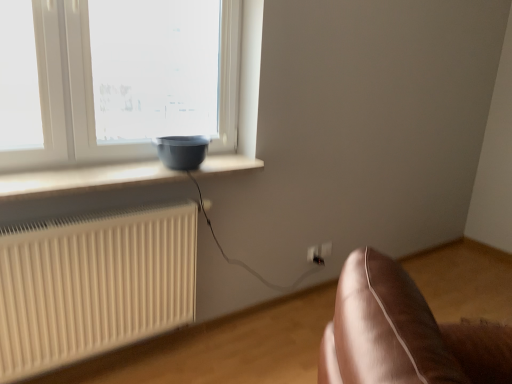
This screenshot has width=512, height=384. What do you see at coordinates (314, 255) in the screenshot? I see `white plastic electric outlet at lower right, which is the 1th electric outlet in left-to-right order` at bounding box center [314, 255].

Locate an element on the screen. white plastic electric outlet at lower right, the first electric outlet viewed from the right is located at coordinates (325, 250).

Considering the relative sizes of white plastic electric outlet at lower right, the second electric outlet when ordered from left to right, and matte black bowl at left in the image provided, is white plastic electric outlet at lower right, the second electric outlet when ordered from left to right, shorter than matte black bowl at left?

Incorrect, the height of white plastic electric outlet at lower right, the second electric outlet when ordered from left to right, does not fall short of that of matte black bowl at left.

How much distance is there between white plastic electric outlet at lower right, acting as the 2th electric outlet starting from the front, and matte black bowl at left?

They are 4.29 feet apart.

From a real-world perspective, between white plastic electric outlet at lower right, acting as the 2th electric outlet starting from the front, and matte black bowl at left, who is vertically higher?

matte black bowl at left is physically above.

How many degrees apart are the facing directions of white plastic electric outlet at lower right, the second electric outlet when ordered from left to right, and matte black bowl at left?

0.199 degrees separate the facing orientations of white plastic electric outlet at lower right, the second electric outlet when ordered from left to right, and matte black bowl at left.

Considering the sizes of objects white plastic electric outlet at lower right, the first electric outlet when ordered from back to front, and matte gray bowl at window in the image provided, who is taller, white plastic electric outlet at lower right, the first electric outlet when ordered from back to front, or matte gray bowl at window?

matte gray bowl at window.

Is white plastic electric outlet at lower right, the second electric outlet when ordered from left to right, further to the viewer compared to matte gray bowl at window?

Yes, it is behind matte gray bowl at window.

Considering the relative positions of white plastic electric outlet at lower right, acting as the 2th electric outlet starting from the front, and matte gray bowl at window in the image provided, is white plastic electric outlet at lower right, acting as the 2th electric outlet starting from the front, to the left or to the right of matte gray bowl at window?

white plastic electric outlet at lower right, acting as the 2th electric outlet starting from the front, is to the right of matte gray bowl at window.

Does white plastic electric outlet at lower right, acting as the 2th electric outlet starting from the front, turn towards matte gray bowl at window?

No.

Between white plastic electric outlet at lower right, marked as the second electric outlet in a right-to-left arrangement, and matte gray bowl at window, which one has larger size?

With larger size is matte gray bowl at window.

From the image's perspective, is white plastic electric outlet at lower right, the 1th electric outlet positioned from the front, beneath matte gray bowl at window?

Yes.

Is the position of white plastic electric outlet at lower right, which is the 1th electric outlet in left-to-right order, less distant than that of matte gray bowl at window?

No, it is behind matte gray bowl at window.

Which is farther from the camera, [315,253] or [199,165]?

Positioned behind is point [315,253].

Identify the location of window sill to the left of white plastic electric outlet at lower right, marked as the second electric outlet in a back-to-front arrangement. This screenshot has width=512, height=384. (84, 179).

Is matte black bowl at left directly adjacent to white plastic electric outlet at lower right, marked as the second electric outlet in a right-to-left arrangement?

matte black bowl at left and white plastic electric outlet at lower right, marked as the second electric outlet in a right-to-left arrangement, are clearly separated.

Is white plastic electric outlet at lower right, the 1th electric outlet positioned from the front, at the back of matte black bowl at left?

No, white plastic electric outlet at lower right, the 1th electric outlet positioned from the front, is not at the back of matte black bowl at left.

Can you tell me how much white plastic electric outlet at lower right, the first electric outlet viewed from the right, and white plastic electric outlet at lower right, marked as the second electric outlet in a right-to-left arrangement, differ in facing direction?

The angle between the facing direction of white plastic electric outlet at lower right, the first electric outlet viewed from the right, and the facing direction of white plastic electric outlet at lower right, marked as the second electric outlet in a right-to-left arrangement, is 4.12 degrees.

Which is behind, point (320, 254) or point (314, 258)?

The point (320, 254) is more distant.

Is white plastic electric outlet at lower right, acting as the 2th electric outlet starting from the front, not inside white plastic electric outlet at lower right, the 1th electric outlet positioned from the front?

Yes, white plastic electric outlet at lower right, acting as the 2th electric outlet starting from the front, is located beyond the bounds of white plastic electric outlet at lower right, the 1th electric outlet positioned from the front.

Does point (195, 165) appear closer or farther from the camera than point (317, 263)?

Point (195, 165) appears to be closer to the viewer than point (317, 263).

Is matte gray bowl at window further to camera compared to white plastic electric outlet at lower right, the 1th electric outlet positioned from the front?

No, it is in front of white plastic electric outlet at lower right, the 1th electric outlet positioned from the front.

Considering the sizes of objects matte gray bowl at window and white plastic electric outlet at lower right, which is the 1th electric outlet in left-to-right order, in the image provided, who is taller, matte gray bowl at window or white plastic electric outlet at lower right, which is the 1th electric outlet in left-to-right order,?

Standing taller between the two is matte gray bowl at window.

Between matte gray bowl at window and white plastic electric outlet at lower right, the 1th electric outlet positioned from the front, which one has smaller size?

white plastic electric outlet at lower right, the 1th electric outlet positioned from the front.

Based on the photo, does white plastic electric outlet at lower right, the 1th electric outlet positioned from the front, have a smaller size compared to white ribbed radiator at lower left?

Yes.

Locate an element on the screen. Image resolution: width=512 pixels, height=384 pixels. radiator on the left of the white plastic electric outlet at lower right, marked as the second electric outlet in a back-to-front arrangement is located at coordinates (93, 285).

Is white plastic electric outlet at lower right, marked as the second electric outlet in a back-to-front arrangement, to the left of white ribbed radiator at lower left from the viewer's perspective?

No, white plastic electric outlet at lower right, marked as the second electric outlet in a back-to-front arrangement, is not to the left of white ribbed radiator at lower left.

Is white plastic electric outlet at lower right, which is the 1th electric outlet in left-to-right order, further to camera compared to white ribbed radiator at lower left?

Yes, the depth of white plastic electric outlet at lower right, which is the 1th electric outlet in left-to-right order, is greater than that of white ribbed radiator at lower left.

Image resolution: width=512 pixels, height=384 pixels. I want to click on the 2nd electric outlet counting from the right side of the matte black bowl at left, so click(325, 250).

At what (x,y) coordinates should I click in order to perform the action: click on bowl that appears in front of the white plastic electric outlet at lower right, the second electric outlet when ordered from left to right. Please return your answer as a coordinate pair (x, y). Looking at the image, I should click on (182, 151).

When comparing their distances from white plastic electric outlet at lower right, the first electric outlet viewed from the right, does matte black bowl at left or matte gray bowl at window seem further?

matte black bowl at left.

Consider the image. Based on their spatial positions, is matte gray bowl at window or matte black bowl at left further from white ribbed radiator at lower left?

The object further to white ribbed radiator at lower left is matte gray bowl at window.

When comparing their distances from white plastic electric outlet at lower right, the first electric outlet when ordered from back to front, does white plastic electric outlet at lower right, marked as the second electric outlet in a right-to-left arrangement, or matte black bowl at left seem closer?

white plastic electric outlet at lower right, marked as the second electric outlet in a right-to-left arrangement, is closer to white plastic electric outlet at lower right, the first electric outlet when ordered from back to front.

Based on their spatial positions, is white plastic electric outlet at lower right, the first electric outlet viewed from the right, or matte black bowl at left further from white plastic electric outlet at lower right, which is the 1th electric outlet in left-to-right order?

matte black bowl at left.

Looking at the image, which one is located closer to white plastic electric outlet at lower right, marked as the second electric outlet in a back-to-front arrangement, matte gray bowl at window or matte black bowl at left?

matte gray bowl at window lies closer to white plastic electric outlet at lower right, marked as the second electric outlet in a back-to-front arrangement, than the other object.

Estimate the real-world distances between objects in this image. Which object is further from white plastic electric outlet at lower right, the first electric outlet when ordered from back to front, matte black bowl at left or white plastic electric outlet at lower right, marked as the second electric outlet in a back-to-front arrangement?

Among the two, matte black bowl at left is located further to white plastic electric outlet at lower right, the first electric outlet when ordered from back to front.

Looking at the image, which one is located further to white ribbed radiator at lower left, white plastic electric outlet at lower right, which is the 1th electric outlet in left-to-right order, or matte gray bowl at window?

Among the two, white plastic electric outlet at lower right, which is the 1th electric outlet in left-to-right order, is located further to white ribbed radiator at lower left.

When comparing their distances from matte black bowl at left, does white plastic electric outlet at lower right, the first electric outlet viewed from the right, or white ribbed radiator at lower left seem closer?

white ribbed radiator at lower left lies closer to matte black bowl at left than the other object.

This screenshot has height=384, width=512. What are the coordinates of `bowl between white ribbed radiator at lower left and white plastic electric outlet at lower right, the 1th electric outlet positioned from the front, in the front-back direction` in the screenshot? It's located at (182, 151).

Locate an element on the screen. The height and width of the screenshot is (384, 512). window sill between matte gray bowl at window and white ribbed radiator at lower left in the vertical direction is located at coordinates pyautogui.click(x=84, y=179).

This screenshot has height=384, width=512. I want to click on electric outlet between matte black bowl at left and white plastic electric outlet at lower right, acting as the 2th electric outlet starting from the front, along the z-axis, so click(x=314, y=255).

Identify the location of window sill positioned between white ribbed radiator at lower left and white plastic electric outlet at lower right, marked as the second electric outlet in a right-to-left arrangement, from near to far. The width and height of the screenshot is (512, 384). (84, 179).